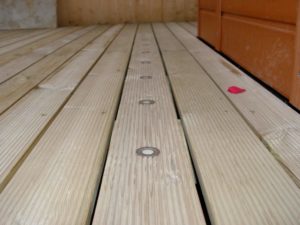
You are a GUI agent. You are given a task and a screenshot of the screen. Output one action in this format:
    pyautogui.click(x=<x>, y=<y>)
    Task: Click on the wooden counter
    
    Given the screenshot: What is the action you would take?
    pyautogui.click(x=99, y=16)